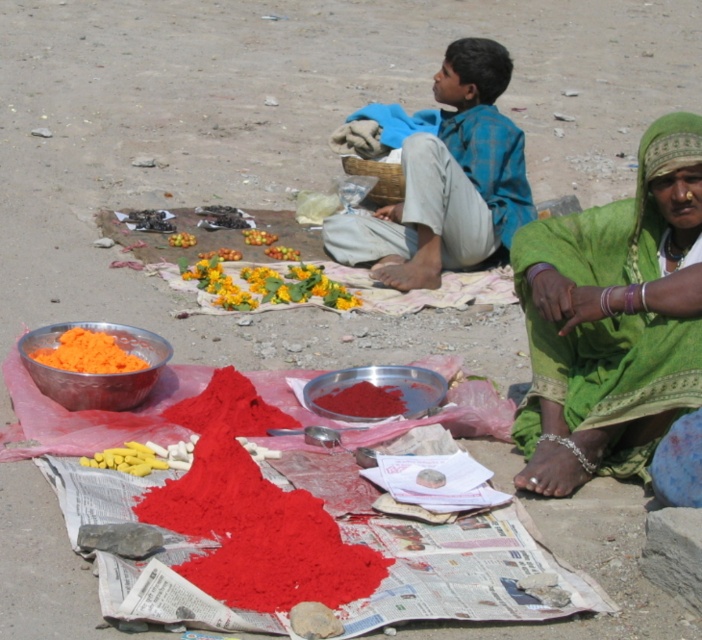
Question: Is blue plaid shirt at upper center smaller than yellow matte flower at center?

Choices:
 (A) yes
 (B) no

Answer: (B)

Question: Which is farther from the bright red powder at center?

Choices:
 (A) yellow soft fruit at center
 (B) yellow fruit at center
 (C) orange powder at lower left
 (D) yellow fabric flower at center

Answer: (B)

Question: Which of the following is the closest to the observer?

Choices:
 (A) yellow fruit at center
 (B) yellow matte flower at center
 (C) orange powder at lower left

Answer: (C)

Question: Can you confirm if yellow matte flower at center is smaller than yellow soft fruit at center?

Choices:
 (A) yes
 (B) no

Answer: (B)

Question: Estimate the real-world distances between objects in this image. Which object is farther from the yellow fabric flower at center?

Choices:
 (A) blue plaid shirt at upper center
 (B) orange powder at lower left
 (C) yellow soft fruit at center
 (D) green fabric at lower right

Answer: (D)

Question: From the image, what is the correct spatial relationship of yellow fruit at center in relation to yellow soft fruit at center?

Choices:
 (A) right
 (B) left

Answer: (A)